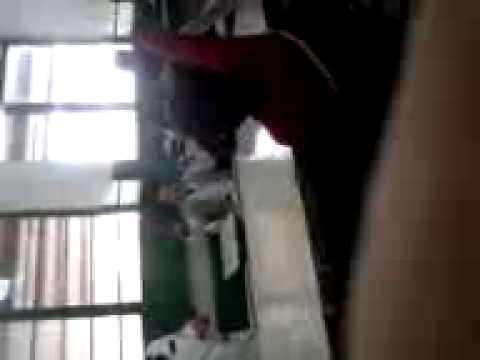
Locate an element on the screen. panes on the left window is located at coordinates (15, 341), (45, 340), (83, 337), (116, 337).